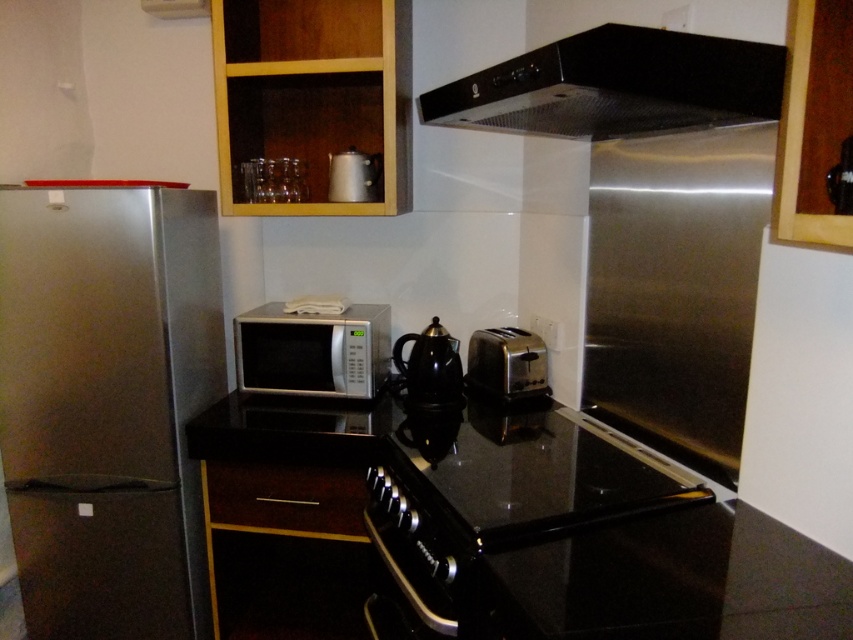
Does silver/glossy microwave at center have a smaller size compared to satin silver toaster at center?

No, silver/glossy microwave at center is not smaller than satin silver toaster at center.

Between point (379, 332) and point (490, 380), which one is positioned behind?

The point (379, 332) is more distant.

The image size is (853, 640). What are the coordinates of `silver/glossy microwave at center` in the screenshot? It's located at (312, 349).

Is point (54, 488) more distant than point (286, 301)?

No, (54, 488) is in front of (286, 301).

Describe the element at coordinates (107, 404) in the screenshot. I see `stainless steel refrigerator at left` at that location.

The width and height of the screenshot is (853, 640). What are the coordinates of `stainless steel refrigerator at left` in the screenshot? It's located at (107, 404).

Can you confirm if black metallic exhaust hood at upper center is positioned to the right of satin silver toaster at center?

Correct, you'll find black metallic exhaust hood at upper center to the right of satin silver toaster at center.

Is black metallic exhaust hood at upper center wider than satin silver toaster at center?

Correct, the width of black metallic exhaust hood at upper center exceeds that of satin silver toaster at center.

Which is behind, point (540, 74) or point (517, 364)?

The point (517, 364) is more distant.

The height and width of the screenshot is (640, 853). Identify the location of black metallic exhaust hood at upper center. (618, 84).